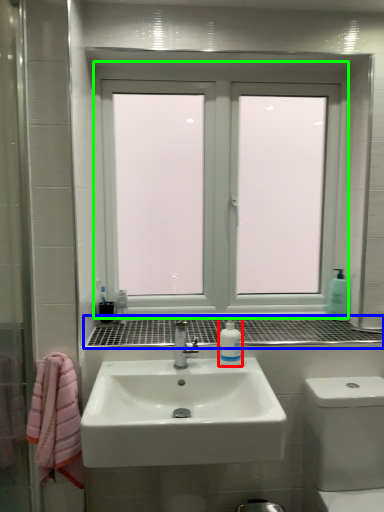
Question: Considering the real-world distances, which object is closest to mouthwash (highlighted by a red box)? window sill (highlighted by a blue box) or window (highlighted by a green box).

Choices:
 (A) window sill
 (B) window

Answer: (A)